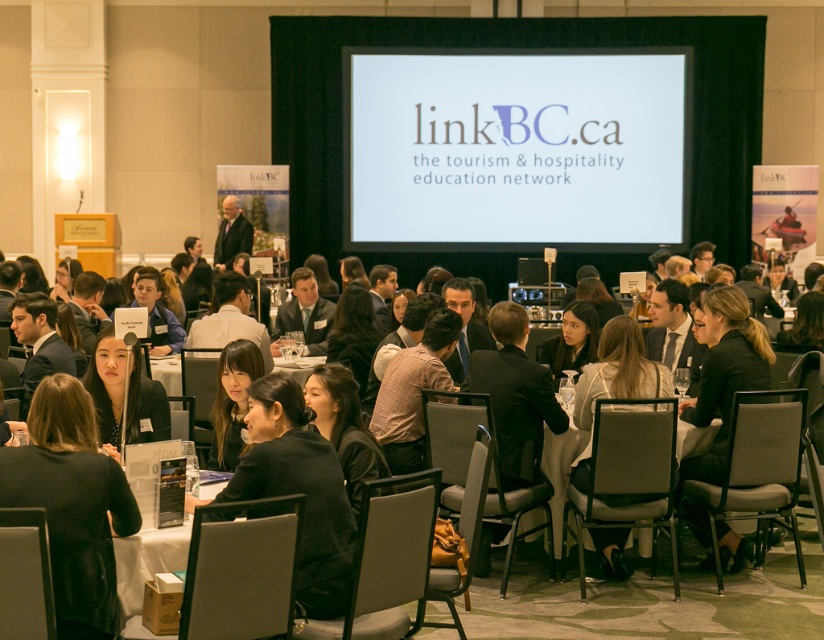
You are organizing a photoshoot for a fashion magazine and need to position two jackets for a spread. The scene shows a formal event with two jackets on display. Which jacket is positioned to the left of the other? The jackets are the black fabric jacket at lower left and the black leather jacket at lower right.

The black fabric jacket at lower left is positioned to the left of the black leather jacket at lower right.

You are an event organizer at the conference. You notice a black leather jacket at lower right and a white paper at center. Which object is positioned higher in the image?

The black leather jacket at lower right is positioned higher than the white paper at center in the image.

You are a photographer at the event and need to capture a photo of both the black fabric jacket at lower left and the black leather jacket at lower right in the same frame. The camera you are using has a maximum focus range of 14 feet. Can you position yourself in a way that both jackets are within the camera focus range?

The distance between the black fabric jacket at lower left and the black leather jacket at lower right is 13.99 feet, which is just under the camera focus range of 14 feet. Therefore, you can position yourself in a way that both jackets are within the camera focus range.